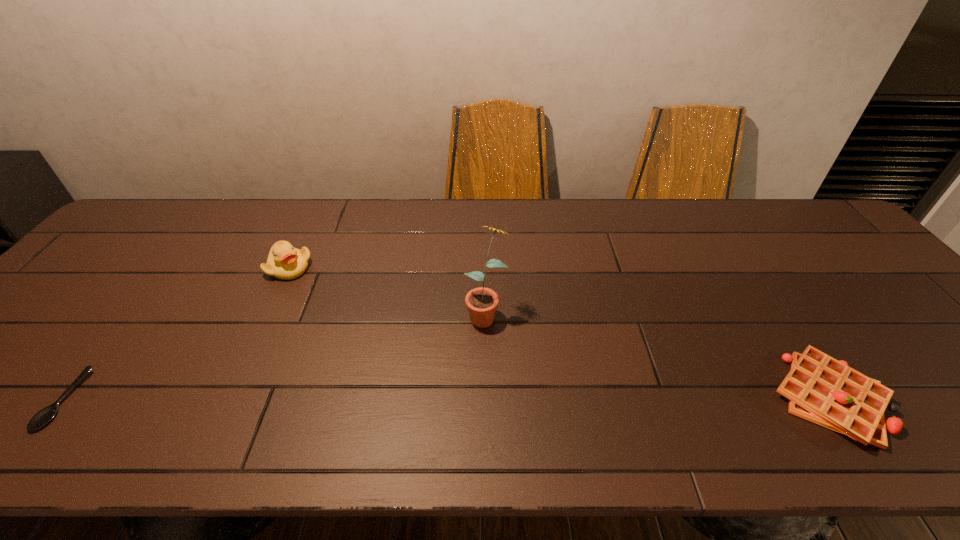
Where is `unoccupied position between the third object from right to left and the third object from left to right`? unoccupied position between the third object from right to left and the third object from left to right is located at coordinates (388, 290).

Where is `vacant space that is in between the sunflower and the waffle`? The image size is (960, 540). vacant space that is in between the sunflower and the waffle is located at coordinates (658, 355).

Find the location of a particular element. This screenshot has width=960, height=540. free spot between the shortest object and the tallest object is located at coordinates (275, 356).

Where is `free spot between the waffle and the second tallest object`? This screenshot has height=540, width=960. free spot between the waffle and the second tallest object is located at coordinates (560, 333).

The height and width of the screenshot is (540, 960). Find the location of `free space between the third object from left to right and the second shortest object`. free space between the third object from left to right and the second shortest object is located at coordinates (658, 355).

At what (x,y) coordinates should I click in order to perform the action: click on unoccupied area between the rightmost object and the farthest object. Please return your answer as a coordinate pair (x, y). Looking at the image, I should click on tap(560, 333).

At what (x,y) coordinates should I click in order to perform the action: click on vacant area that lies between the farthest object and the leftmost object. Please return your answer as a coordinate pair (x, y). Image resolution: width=960 pixels, height=540 pixels. Looking at the image, I should click on (177, 334).

Locate an element on the screen. The image size is (960, 540). vacant space that's between the second shortest object and the soupspoon is located at coordinates (446, 399).

The width and height of the screenshot is (960, 540). I want to click on free space that is in between the farthest object and the soupspoon, so pyautogui.click(x=177, y=334).

Identify the location of vacant region between the rightmost object and the soupspoon. (446, 399).